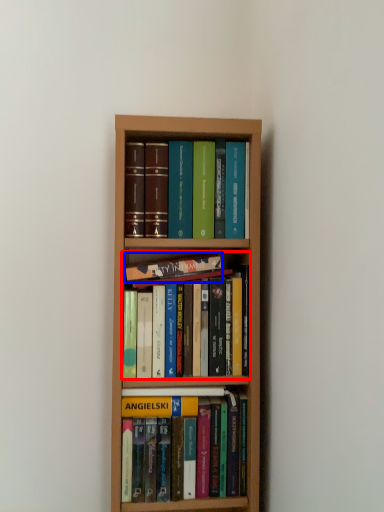
Question: Which of the following is the closest to the observer, book (highlighted by a red box) or book (highlighted by a blue box)?

Choices:
 (A) book
 (B) book

Answer: (A)